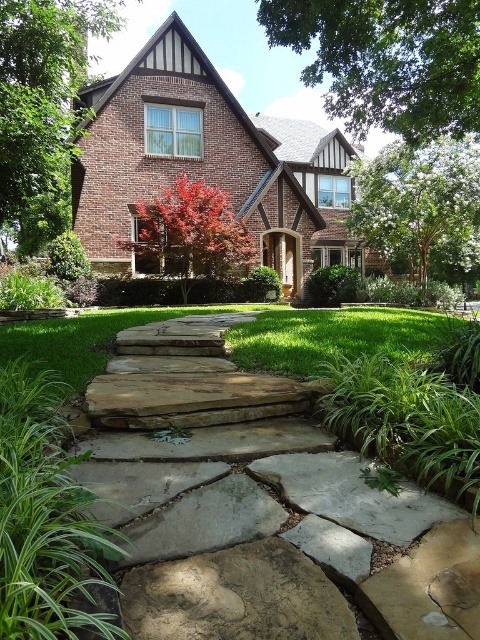
Question: Which is nearer to the natural stone pathway at center?

Choices:
 (A) gray/rough stone at center
 (B) shiny red maple tree at center
 (C) reddish-brown bark tree at upper left
 (D) green grass at center

Answer: (A)

Question: Does reddish-brown bark tree at upper left have a smaller size compared to brown rough stone at center?

Choices:
 (A) no
 (B) yes

Answer: (A)

Question: Which object is farther from the camera taking this photo?

Choices:
 (A) green grass at center
 (B) shiny red maple tree at center
 (C) reddish-brown bark tree at upper left

Answer: (B)

Question: In this image, where is green leafy tree at upper center located relative to shiny red maple tree at center?

Choices:
 (A) right
 (B) left

Answer: (A)

Question: Which object is the farthest from the reddish-brown bark tree at upper left?

Choices:
 (A) natural stone pathway at center
 (B) white textured tree at upper right

Answer: (B)

Question: Does reddish-brown bark tree at upper left appear over shiny red maple tree at center?

Choices:
 (A) yes
 (B) no

Answer: (A)